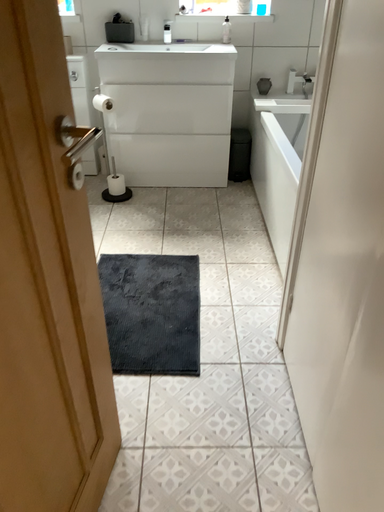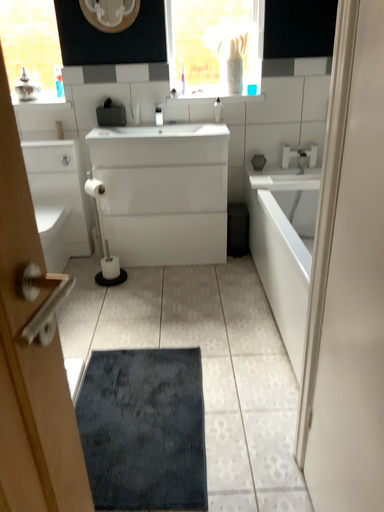
Question: Which way did the camera rotate in the video?

Choices:
 (A) rotated downward
 (B) rotated upward

Answer: (B)